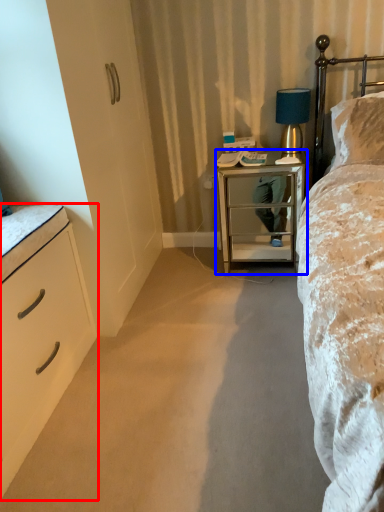
Question: Among these objects, which one is nearest to the camera, chest of drawers (highlighted by a red box) or nightstand (highlighted by a blue box)?

Choices:
 (A) chest of drawers
 (B) nightstand

Answer: (A)